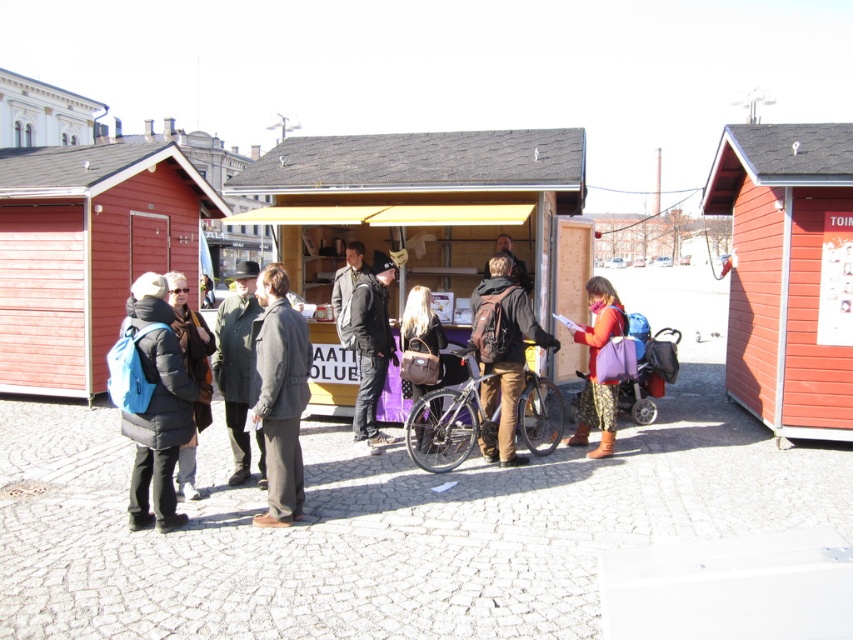
You are standing at the center of the cobblestone area and want to walk towards both the point at coordinates [91,289] and the point at [608,381]. Which point will you reach first?

You will reach the point at coordinates [91,289] first because it is closer to you than the point at [608,381], which is further away.